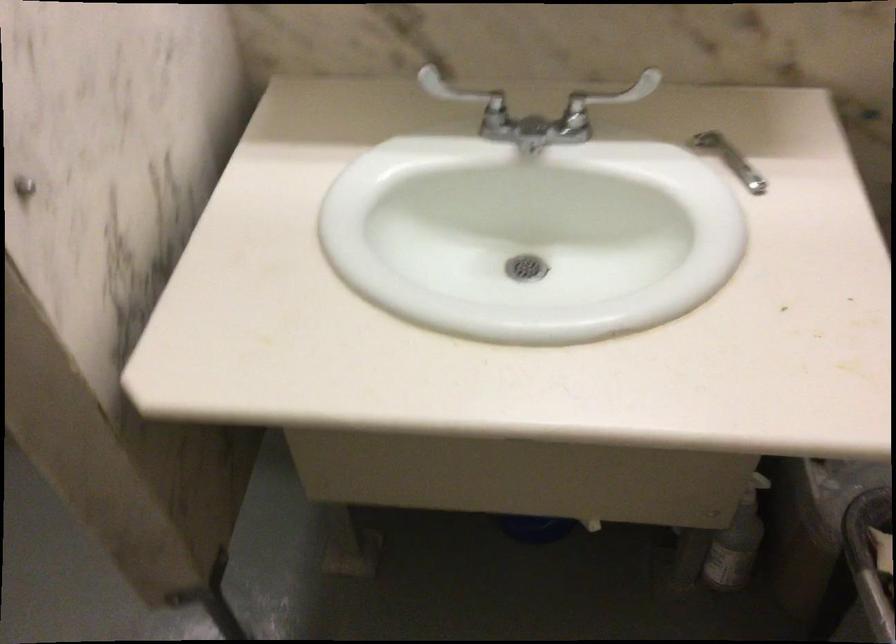
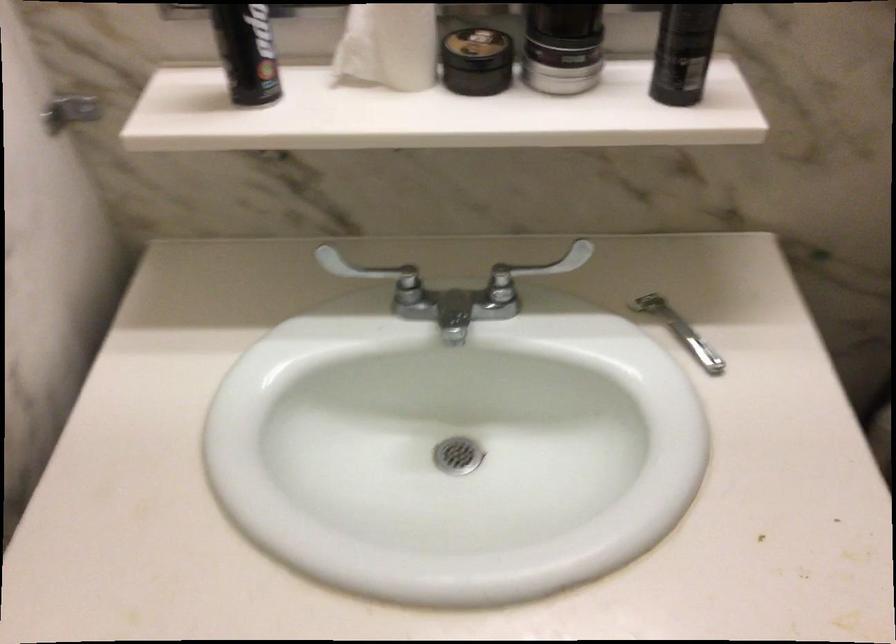
Question: Based on the continuous images, in which direction is the camera rotating? Reply with the corresponding letter.

Choices:
 (A) Left
 (B) Right
 (C) Up
 (D) Down

Answer: (B)